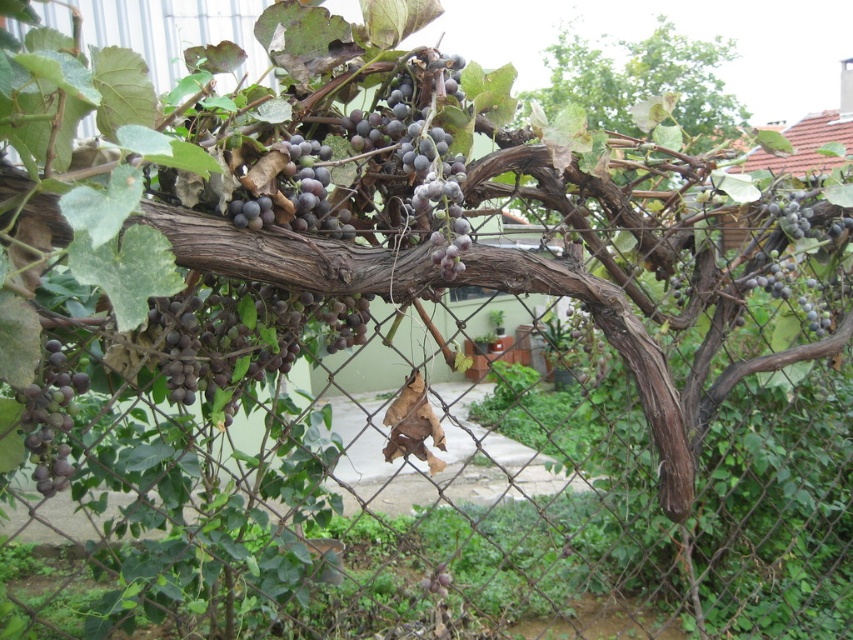
You are standing in front of a chain link fence with grapevines. You see two clusters of grapes, the purple matte grapes at lower left and the dark purple grapes at upper right. Which cluster of grapes is closer to you?

The purple matte grapes at lower left are closer to the viewer than the dark purple grapes at upper right.

You are a gardener holding a 4.5 inch long pruning shears. You want to trim the dark purple grapes at right and the dark purple grapes at upper right. Can you reach both clusters with your shears without moving your position?

The distance between the dark purple grapes at right and dark purple grapes at upper right is 5.03 inches. Since your shears are only 4.5 inches long, you cannot reach both clusters without moving your position.

You are a gardener trying to prune the green leafy tree at upper center and the dark purple grapes at right. Which object is located above the other?

The green leafy tree at upper center is positioned over the dark purple grapes at right.